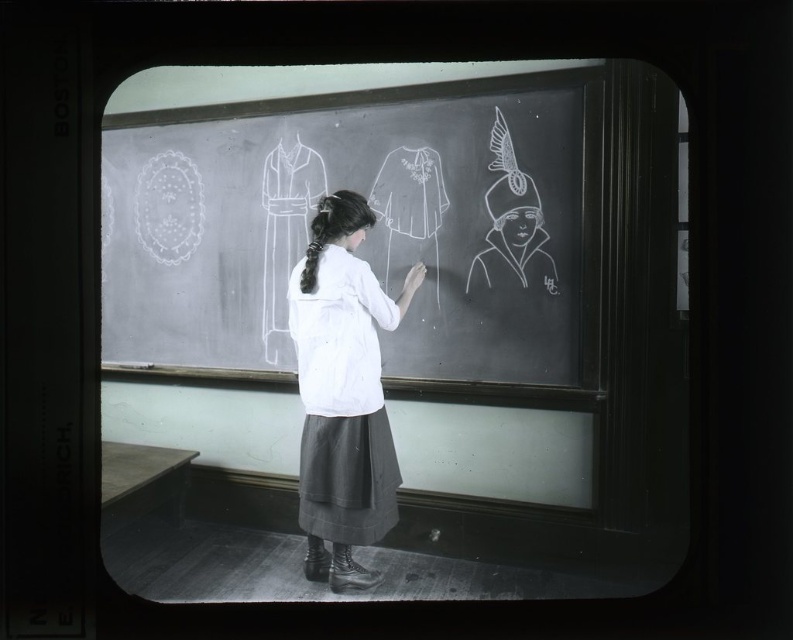
Question: Which of the following is the closest to the observer?

Choices:
 (A) [x=280, y=230]
 (B) [x=370, y=513]

Answer: (B)

Question: Can you confirm if white cotton blouse at center is positioned to the right of white chalk dress at center?

Choices:
 (A) yes
 (B) no

Answer: (A)

Question: Can you confirm if white cotton blouse at center is positioned below white chalk dress at center?

Choices:
 (A) no
 (B) yes

Answer: (B)

Question: In this image, where is white cotton blouse at center located relative to white chalk dress at center?

Choices:
 (A) below
 (B) above

Answer: (A)

Question: Which point appears farthest from the camera in this image?

Choices:
 (A) (288, 240)
 (B) (368, 330)

Answer: (A)